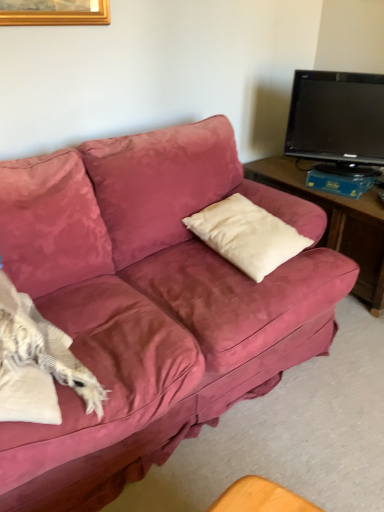
The width and height of the screenshot is (384, 512). What do you see at coordinates (338, 120) in the screenshot?
I see `black glossy tv at upper right` at bounding box center [338, 120].

The height and width of the screenshot is (512, 384). I want to click on black glossy tv at upper right, so (x=338, y=120).

In order to face white soft cushion at center, should I rotate leftwards or rightwards?

You should rotate right by 7.474 degrees.

This screenshot has height=512, width=384. In order to click on white soft cushion at center in this screenshot , I will do pos(247,234).

The width and height of the screenshot is (384, 512). What do you see at coordinates (247, 234) in the screenshot? I see `white soft cushion at center` at bounding box center [247, 234].

Where is `black glossy tv at upper right`? The height and width of the screenshot is (512, 384). black glossy tv at upper right is located at coordinates (338, 120).

Can you confirm if black glossy tv at upper right is positioned to the left of white soft cushion at center?

No, black glossy tv at upper right is not to the left of white soft cushion at center.

Which is in front, black glossy tv at upper right or white soft cushion at center?

Positioned in front is white soft cushion at center.

Between point (345, 158) and point (256, 259), which one is positioned behind?

The point (345, 158) is farther.

From the image's perspective, is black glossy tv at upper right located above white soft cushion at center?

Correct, black glossy tv at upper right appears higher than white soft cushion at center in the image.

From a real-world perspective, is black glossy tv at upper right physically above white soft cushion at center?

Yes.

Is black glossy tv at upper right thinner than white soft cushion at center?

Yes, black glossy tv at upper right is thinner than white soft cushion at center.

From their relative heights in the image, would you say black glossy tv at upper right is taller or shorter than white soft cushion at center?

In the image, black glossy tv at upper right appears to be taller than white soft cushion at center.

Between black glossy tv at upper right and white soft cushion at center, which one has smaller size?

With smaller size is white soft cushion at center.

Is black glossy tv at upper right spatially inside white soft cushion at center, or outside of it?

black glossy tv at upper right cannot be found inside white soft cushion at center.

Can you see black glossy tv at upper right touching white soft cushion at center?

No, black glossy tv at upper right is not in contact with white soft cushion at center.

From the picture: Is black glossy tv at upper right facing away from white soft cushion at center?

black glossy tv at upper right is not turned away from white soft cushion at center.

Can you tell me how much black glossy tv at upper right and white soft cushion at center differ in facing direction?

The angular difference between black glossy tv at upper right and white soft cushion at center is 36.7 degrees.

How far apart are black glossy tv at upper right and white soft cushion at center?

black glossy tv at upper right and white soft cushion at center are 29.78 inches apart.

The width and height of the screenshot is (384, 512). I want to click on television behind the white soft cushion at center, so click(338, 120).

Does white soft cushion at center appear on the left side of black glossy tv at upper right?

Correct, you'll find white soft cushion at center to the left of black glossy tv at upper right.

Consider the image. Does white soft cushion at center lie in front of black glossy tv at upper right?

Yes, white soft cushion at center is closer to the camera.

Considering the points (283, 229) and (305, 128), which point is behind, point (283, 229) or point (305, 128)?

The point (305, 128) is behind.

From the image's perspective, between white soft cushion at center and black glossy tv at upper right, which one is located above?

From the image's view, black glossy tv at upper right is above.

From a real-world perspective, relative to black glossy tv at upper right, is white soft cushion at center vertically above or below?

Clearly, from a real-world perspective, white soft cushion at center is below black glossy tv at upper right.

Which object is wider, white soft cushion at center or black glossy tv at upper right?

white soft cushion at center is wider.

Who is taller, white soft cushion at center or black glossy tv at upper right?

black glossy tv at upper right.

In terms of size, does white soft cushion at center appear bigger or smaller than black glossy tv at upper right?

white soft cushion at center is smaller than black glossy tv at upper right.

Can black glossy tv at upper right be found inside white soft cushion at center?

No, black glossy tv at upper right is not a part of white soft cushion at center.

Looking at this image, is the surface of white soft cushion at center in direct contact with black glossy tv at upper right?

No, white soft cushion at center is not next to black glossy tv at upper right.

Does white soft cushion at center turn towards black glossy tv at upper right?

No, white soft cushion at center does not turn towards black glossy tv at upper right.

What's the angular difference between white soft cushion at center and black glossy tv at upper right's facing directions?

The angular difference between white soft cushion at center and black glossy tv at upper right is 36.7 degrees.

Measure the distance between white soft cushion at center and black glossy tv at upper right.

A distance of 29.78 inches exists between white soft cushion at center and black glossy tv at upper right.

At what (x,y) coordinates should I click in order to perform the action: click on television behind the white soft cushion at center. Please return your answer as a coordinate pair (x, y). Looking at the image, I should click on (338, 120).

I want to click on television above the white soft cushion at center (from the image's perspective), so click(x=338, y=120).

You are a GUI agent. You are given a task and a screenshot of the screen. Output one action in this format:
    pyautogui.click(x=<x>, y=<y>)
    Task: Click on the television located above the white soft cushion at center (from a real-world perspective)
    This screenshot has width=384, height=512.
    Given the screenshot: What is the action you would take?
    pyautogui.click(x=338, y=120)